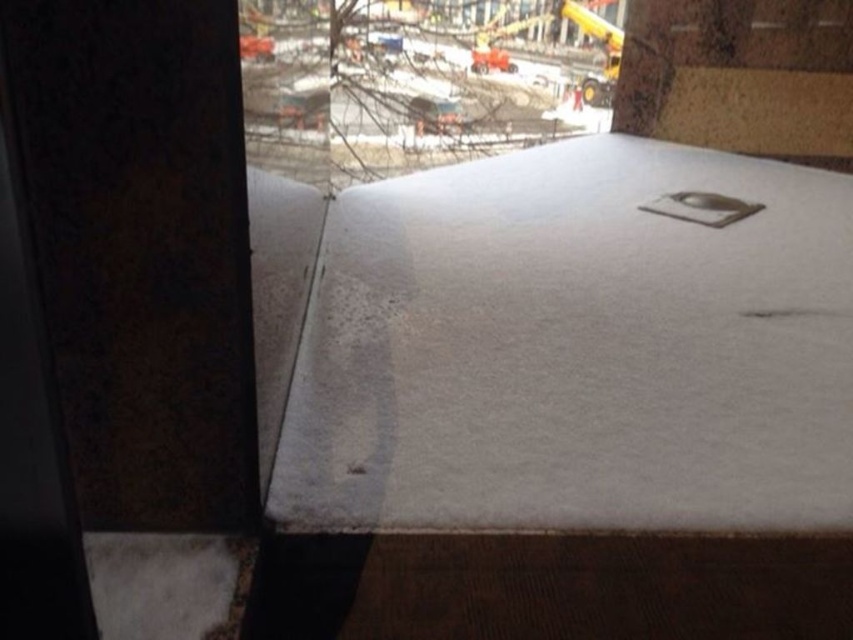
Where is `white matte blanket at center`? The image size is (853, 640). white matte blanket at center is located at coordinates (576, 349).

Consider the image. Who is more forward, [561,464] or [370,152]?

Positioned in front is point [561,464].

Where is `white matte blanket at center`? This screenshot has height=640, width=853. white matte blanket at center is located at coordinates (576, 349).

Based on the photo, can you confirm if transparent glass window at upper center is wider than white cardboard box at upper right?

No, transparent glass window at upper center is not wider than white cardboard box at upper right.

Is transparent glass window at upper center below white cardboard box at upper right?

Indeed, transparent glass window at upper center is positioned under white cardboard box at upper right.

Between point (316, 106) and point (729, 148), which one is positioned behind?

Positioned behind is point (729, 148).

In order to click on transparent glass window at upper center in this screenshot , I will do `click(412, 81)`.

Can you confirm if white matte blanket at center is wider than white cardboard box at upper right?

Indeed, white matte blanket at center has a greater width compared to white cardboard box at upper right.

Between white matte blanket at center and white cardboard box at upper right, which one is positioned lower?

white matte blanket at center

The height and width of the screenshot is (640, 853). What do you see at coordinates (576, 349) in the screenshot? I see `white matte blanket at center` at bounding box center [576, 349].

The height and width of the screenshot is (640, 853). What are the coordinates of `white matte blanket at center` in the screenshot? It's located at (576, 349).